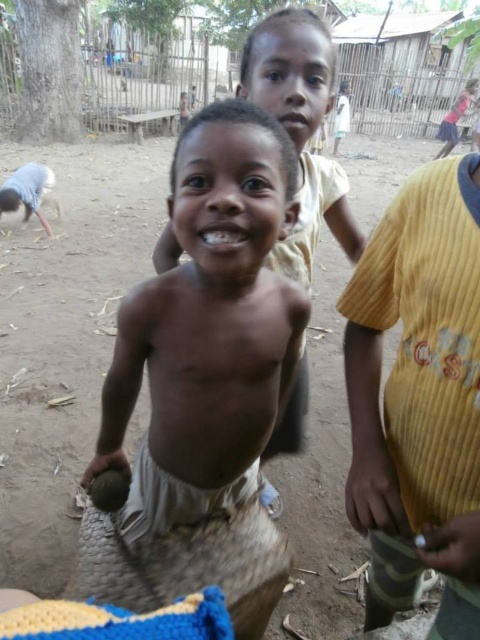
Question: Is yellow corduroy shirt at right above pink matte mouth at upper center?

Choices:
 (A) no
 (B) yes

Answer: (A)

Question: Can you confirm if brown skin/soft skin child at center is bigger than bright white teeth at center?

Choices:
 (A) yes
 (B) no

Answer: (A)

Question: Estimate the real-world distances between objects in this image. Which object is closer to the pink matte mouth at upper center?

Choices:
 (A) brown skin/soft skin child at center
 (B) yellow corduroy shirt at right

Answer: (A)

Question: Which object is positioned closest to the yellow corduroy shirt at right?

Choices:
 (A) brown skin/soft skin child at center
 (B) bright white teeth at center

Answer: (A)

Question: Is yellow corduroy shirt at right to the left of pink matte mouth at upper center from the viewer's perspective?

Choices:
 (A) no
 (B) yes

Answer: (A)

Question: Which of these objects is positioned farthest from the pink matte mouth at upper center?

Choices:
 (A) brown skin/soft skin child at center
 (B) yellow corduroy shirt at right
 (C) bright white teeth at center

Answer: (B)